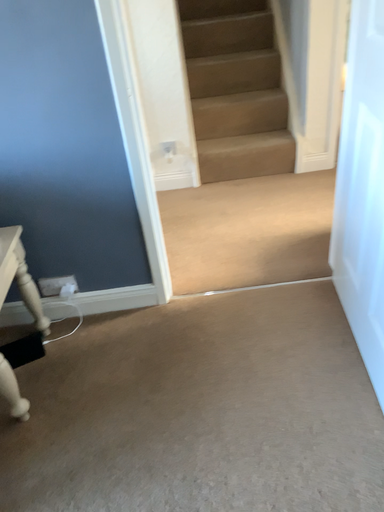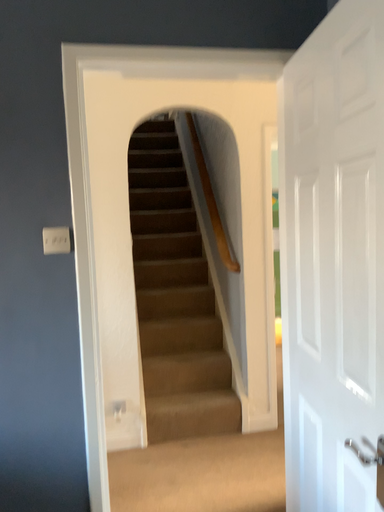
Question: Which way did the camera rotate in the video?

Choices:
 (A) rotated downward
 (B) rotated upward

Answer: (B)